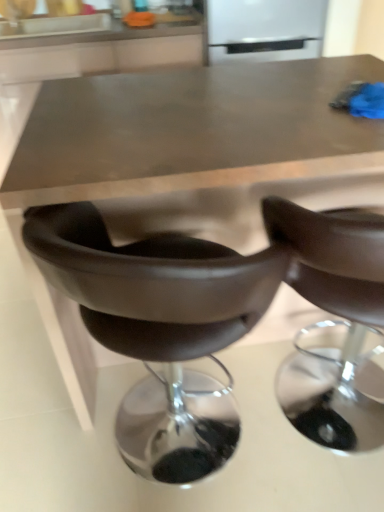
What do you see at coordinates (265, 29) in the screenshot? I see `white glossy refrigerator at upper center` at bounding box center [265, 29].

Locate an element on the screen. This screenshot has height=512, width=384. metallic brown table at center is located at coordinates (177, 153).

Considering the sizes of metallic brown table at center and brown leather chair at center, positioned as the first chair in front-to-back order, in the image, is metallic brown table at center taller or shorter than brown leather chair at center, positioned as the first chair in front-to-back order,?

In the image, metallic brown table at center appears to be taller than brown leather chair at center, positioned as the first chair in front-to-back order.

Can you tell me how much metallic brown table at center and brown leather chair at center, the second chair when ordered from back to front, differ in facing direction?

179 degrees separate the facing orientations of metallic brown table at center and brown leather chair at center, the second chair when ordered from back to front.

Are metallic brown table at center and brown leather chair at center, positioned as the first chair in front-to-back order, beside each other?

metallic brown table at center is not next to brown leather chair at center, positioned as the first chair in front-to-back order, and they're not touching.

Does metallic brown table at center turn towards brown leather chair at center, positioned as the first chair in front-to-back order?

Yes, metallic brown table at center is aimed at brown leather chair at center, positioned as the first chair in front-to-back order.

From the picture: Is metallic brown table at center wider or thinner than white glossy refrigerator at upper center?

Considering their sizes, metallic brown table at center looks broader than white glossy refrigerator at upper center.

From the image's perspective, would you say metallic brown table at center is shown under white glossy refrigerator at upper center?

Yes, from the image's perspective, metallic brown table at center is beneath white glossy refrigerator at upper center.

Is metallic brown table at center positioned far away from white glossy refrigerator at upper center?

Absolutely, metallic brown table at center is distant from white glossy refrigerator at upper center.

Identify the location of table on the right of leather-like brown chair at lower center, which ranks as the 1th chair in back-to-front order. (177, 153).

From a real-world perspective, which object rests below the other?

leather-like brown chair at lower center, which is the 2th chair in front-to-back order, is physically lower.

Looking at this image, is metallic brown table at center touching leather-like brown chair at lower center, which ranks as the 1th chair in back-to-front order?

metallic brown table at center is not next to leather-like brown chair at lower center, which ranks as the 1th chair in back-to-front order, and they're not touching.

Can you tell me how much metallic brown table at center and leather-like brown chair at lower center, which ranks as the 1th chair in back-to-front order, differ in facing direction?

There is a 179-degree angle between the facing directions of metallic brown table at center and leather-like brown chair at lower center, which ranks as the 1th chair in back-to-front order.

Is brown leather chair at center, the second chair when ordered from back to front, facing towards metallic brown table at center?

Yes, brown leather chair at center, the second chair when ordered from back to front, is oriented towards metallic brown table at center.

Is brown leather chair at center, the second chair when ordered from back to front, located outside metallic brown table at center?

No, brown leather chair at center, the second chair when ordered from back to front, is not entirely external to metallic brown table at center.

From the image's perspective, is brown leather chair at center, positioned as the first chair in front-to-back order, positioned above or below metallic brown table at center?

From the image's perspective, brown leather chair at center, positioned as the first chair in front-to-back order, appears below metallic brown table at center.

Is brown leather chair at center, the second chair when ordered from back to front, positioned in front of metallic brown table at center?

Yes, brown leather chair at center, the second chair when ordered from back to front, is closer to the camera.

Is brown leather chair at center, positioned as the first chair in front-to-back order, completely or partially inside white glossy refrigerator at upper center?

Actually, brown leather chair at center, positioned as the first chair in front-to-back order, is outside white glossy refrigerator at upper center.

Consider the image. Who is taller, white glossy refrigerator at upper center or brown leather chair at center, positioned as the first chair in front-to-back order?

brown leather chair at center, positioned as the first chair in front-to-back order, is taller.

Is white glossy refrigerator at upper center far away from brown leather chair at center, positioned as the first chair in front-to-back order?

Yes, white glossy refrigerator at upper center and brown leather chair at center, positioned as the first chair in front-to-back order, are located far from each other.

Looking at their sizes, would you say brown leather chair at center, the second chair when ordered from back to front, is wider or thinner than leather-like brown chair at lower center, which ranks as the 1th chair in back-to-front order?

brown leather chair at center, the second chair when ordered from back to front, is thinner than leather-like brown chair at lower center, which ranks as the 1th chair in back-to-front order.

You are a GUI agent. You are given a task and a screenshot of the screen. Output one action in this format:
    pyautogui.click(x=<x>, y=<y>)
    Task: Click on the chair above the leather-like brown chair at lower center, which is the 2th chair in front-to-back order (from a real-world perspective)
    Image resolution: width=384 pixels, height=512 pixels.
    Given the screenshot: What is the action you would take?
    pyautogui.click(x=333, y=323)

Considering the positions of point (354, 431) and point (51, 234), is point (354, 431) closer or farther from the camera than point (51, 234)?

Clearly, point (354, 431) is more distant from the camera than point (51, 234).

Is brown leather chair at center, the second chair when ordered from back to front, aimed at leather-like brown chair at lower center, which ranks as the 1th chair in back-to-front order?

No, brown leather chair at center, the second chair when ordered from back to front, does not turn towards leather-like brown chair at lower center, which ranks as the 1th chair in back-to-front order.

From the picture: Would you say white glossy refrigerator at upper center contains metallic brown table at center?

Definitely not — metallic brown table at center is not inside white glossy refrigerator at upper center.

Is white glossy refrigerator at upper center facing towards metallic brown table at center?

Yes, white glossy refrigerator at upper center is aimed at metallic brown table at center.

This screenshot has width=384, height=512. I want to click on table that appears behind the brown leather chair at center, the second chair when ordered from back to front, so click(x=177, y=153).

At what (x,y) coordinates should I click in order to perform the action: click on appliance that appears above the metallic brown table at center (from a real-world perspective). Please return your answer as a coordinate pair (x, y). This screenshot has width=384, height=512. Looking at the image, I should click on (265, 29).

Considering their positions, is metallic brown table at center positioned further to brown leather chair at center, positioned as the first chair in front-to-back order, than leather-like brown chair at lower center, which is the 2th chair in front-to-back order?

metallic brown table at center is further to brown leather chair at center, positioned as the first chair in front-to-back order.

Which object lies further to the anchor point brown leather chair at center, positioned as the first chair in front-to-back order, metallic brown table at center or white glossy refrigerator at upper center?

The object further to brown leather chair at center, positioned as the first chair in front-to-back order, is white glossy refrigerator at upper center.

Which object lies further to the anchor point leather-like brown chair at lower center, which is the 2th chair in front-to-back order, metallic brown table at center or brown leather chair at center, positioned as the first chair in front-to-back order?

Based on the image, brown leather chair at center, positioned as the first chair in front-to-back order, appears to be further to leather-like brown chair at lower center, which is the 2th chair in front-to-back order.

When comparing their distances from brown leather chair at center, the second chair when ordered from back to front, does leather-like brown chair at lower center, which is the 2th chair in front-to-back order, or metallic brown table at center seem further?

metallic brown table at center lies further to brown leather chair at center, the second chair when ordered from back to front, than the other object.

Looking at the image, which one is located further to white glossy refrigerator at upper center, brown leather chair at center, the second chair when ordered from back to front, or leather-like brown chair at lower center, which is the 2th chair in front-to-back order?

leather-like brown chair at lower center, which is the 2th chair in front-to-back order, is further to white glossy refrigerator at upper center.

When comparing their distances from brown leather chair at center, the second chair when ordered from back to front, does white glossy refrigerator at upper center or metallic brown table at center seem closer?

metallic brown table at center lies closer to brown leather chair at center, the second chair when ordered from back to front, than the other object.

Which object lies further to the anchor point leather-like brown chair at lower center, which ranks as the 1th chair in back-to-front order, white glossy refrigerator at upper center or metallic brown table at center?

white glossy refrigerator at upper center lies further to leather-like brown chair at lower center, which ranks as the 1th chair in back-to-front order, than the other object.

Looking at the image, which one is located closer to white glossy refrigerator at upper center, brown leather chair at center, positioned as the first chair in front-to-back order, or metallic brown table at center?

Among the two, metallic brown table at center is located nearer to white glossy refrigerator at upper center.

The width and height of the screenshot is (384, 512). In order to click on table between white glossy refrigerator at upper center and brown leather chair at center, positioned as the first chair in front-to-back order, from top to bottom in this screenshot , I will do `click(177, 153)`.

Identify the location of table between white glossy refrigerator at upper center and leather-like brown chair at lower center, which ranks as the 1th chair in back-to-front order, in the vertical direction. [177, 153].

Find the location of `table located between leather-like brown chair at lower center, which is the 2th chair in front-to-back order, and brown leather chair at center, the second chair when ordered from back to front, in the left-right direction`. table located between leather-like brown chair at lower center, which is the 2th chair in front-to-back order, and brown leather chair at center, the second chair when ordered from back to front, in the left-right direction is located at coordinates 177,153.

Locate an element on the screen. This screenshot has height=512, width=384. chair that lies between white glossy refrigerator at upper center and leather-like brown chair at lower center, which is the 2th chair in front-to-back order, from top to bottom is located at coordinates (333, 323).